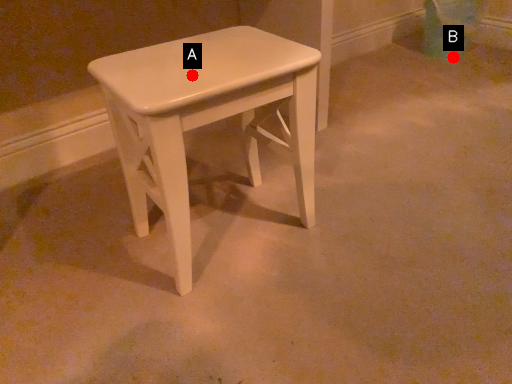
Question: Two points are circled on the image, labeled by A and B beside each circle. Which point is closer to the camera?

Choices:
 (A) A is closer
 (B) B is closer

Answer: (A)